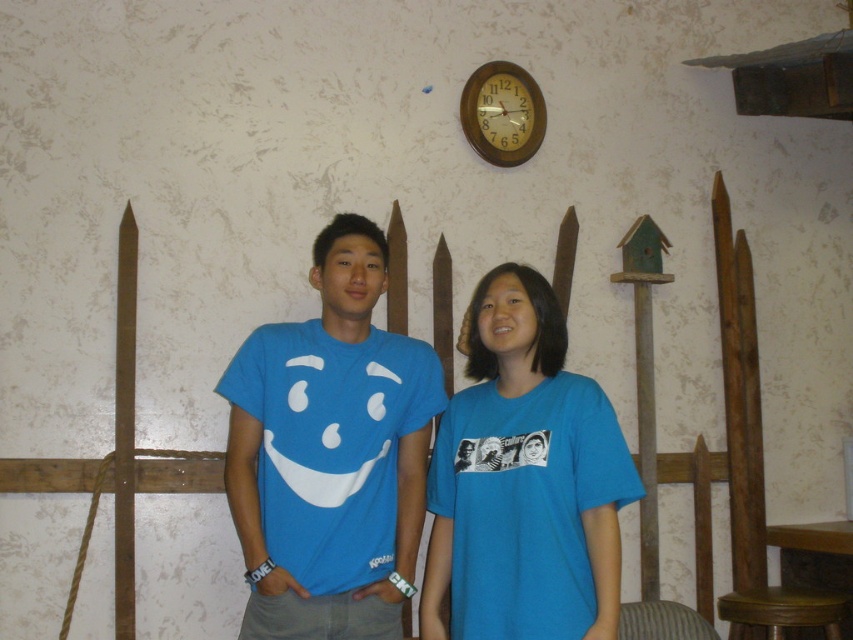
In the scene shown: You are standing in the room and want to move from the blue cotton shirt at center to the brown wooden stool at lower right. Which direction should you move to reach the stool?

The blue cotton shirt at center is to the left of the brown wooden stool at lower right, so you should move to the right to reach the stool.

You are standing in a room with a rustic wooden fence wall. You see a blue cotton shirt at center and a wooden clock at upper center. Which object is positioned to the left of the other?

The blue cotton shirt at center is to the left of the wooden clock at upper center.